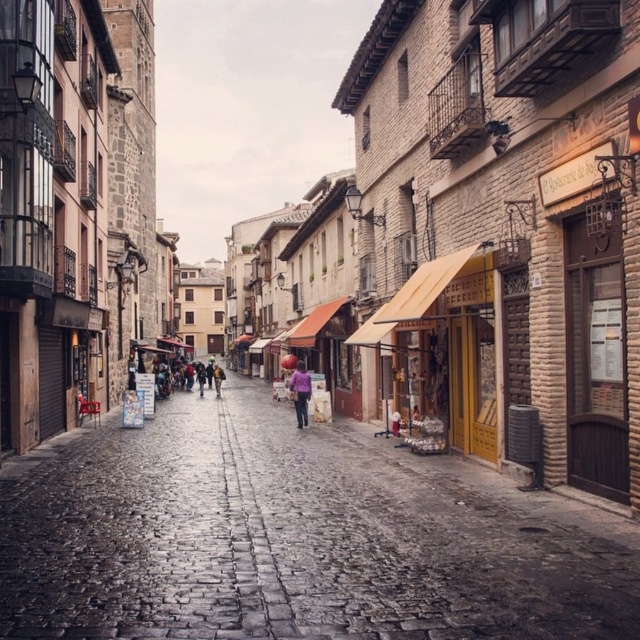
Which is more to the right, cobblestone street at center or purple fabric at center?

From the viewer's perspective, purple fabric at center appears more on the right side.

I want to click on cobblestone street at center, so click(294, 536).

Image resolution: width=640 pixels, height=640 pixels. What are the coordinates of `cobblestone street at center` in the screenshot? It's located at (294, 536).

Where is `cobblestone street at center`? Image resolution: width=640 pixels, height=640 pixels. cobblestone street at center is located at coordinates (294, 536).

Which is below, cobblestone street at center or dark purple sweater at center?

dark purple sweater at center is lower down.

Does cobblestone street at center appear under dark purple sweater at center?

No.

Which is behind, point (227, 397) or point (211, 362)?

The point (211, 362) is more distant.

You are a GUI agent. You are given a task and a screenshot of the screen. Output one action in this format:
    pyautogui.click(x=<x>, y=<y>)
    Task: Click on the cobblestone street at center
    The width and height of the screenshot is (640, 640).
    Given the screenshot: What is the action you would take?
    pyautogui.click(x=294, y=536)

Is dark purple sweater at center to the right of purple fabric umbrella at center from the viewer's perspective?

No, dark purple sweater at center is not to the right of purple fabric umbrella at center.

Which is more to the right, dark purple sweater at center or purple fabric umbrella at center?

From the viewer's perspective, purple fabric umbrella at center appears more on the right side.

Is point (209, 372) less distant than point (216, 384)?

No.

Find the location of a particular element. dark purple sweater at center is located at coordinates (200, 372).